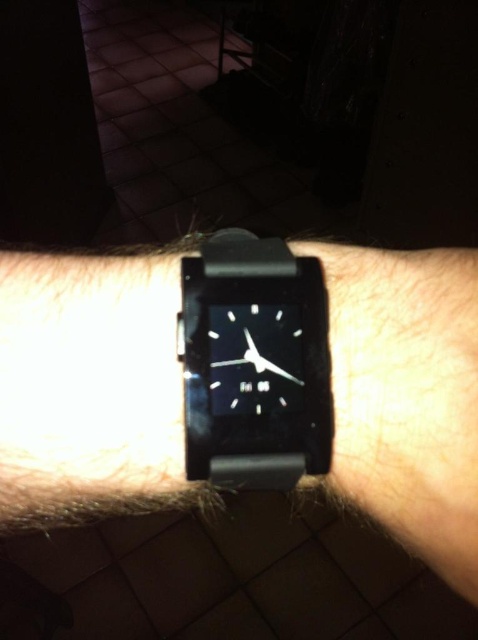
Question: Is black matte watch at center wider than black rubber watch at center?

Choices:
 (A) yes
 (B) no

Answer: (A)

Question: Which object is closer to the camera taking this photo?

Choices:
 (A) black rubber watch at center
 (B) black matte watch at center

Answer: (B)

Question: Which object is closer to the camera taking this photo?

Choices:
 (A) black rubber watch at center
 (B) black matte watch at center

Answer: (B)

Question: Among these objects, which one is nearest to the camera?

Choices:
 (A) black rubber watch at center
 (B) black matte watch at center

Answer: (B)

Question: Is black matte watch at center below black rubber watch at center?

Choices:
 (A) no
 (B) yes

Answer: (B)

Question: Can you confirm if black matte watch at center is positioned below black rubber watch at center?

Choices:
 (A) yes
 (B) no

Answer: (A)